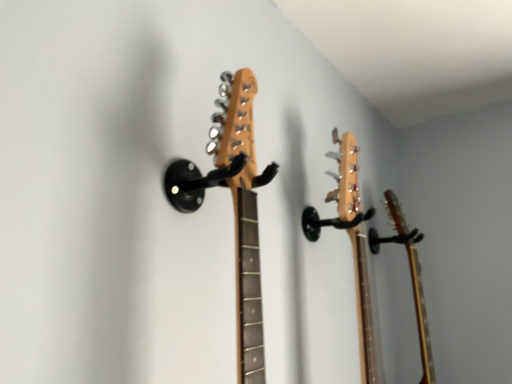
The width and height of the screenshot is (512, 384). I want to click on natural wood guitar at center, so click(x=351, y=242).

Describe the element at coordinates (351, 242) in the screenshot. This screenshot has width=512, height=384. I see `natural wood guitar at center` at that location.

Image resolution: width=512 pixels, height=384 pixels. What are the coordinates of `natural wood guitar at center` in the screenshot? It's located at (351, 242).